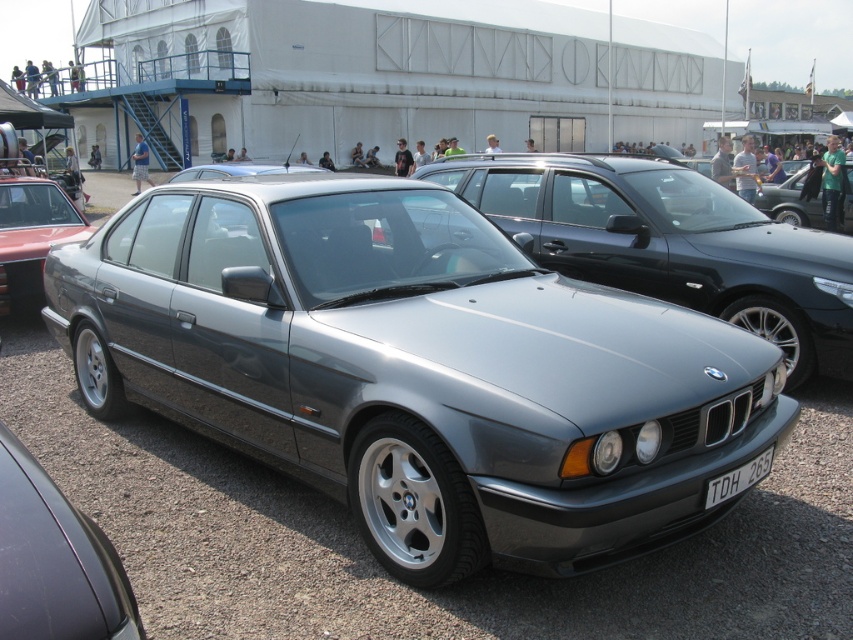
Is satin metallic car at center closer to camera compared to satin metallic sedan at center?

Yes, it is.

Between satin metallic car at center and satin metallic sedan at center, which one is positioned higher?

satin metallic sedan at center

Is point (373, 417) positioned behind point (666, 193)?

No, (373, 417) is in front of (666, 193).

The image size is (853, 640). Identify the location of satin metallic car at center. (416, 369).

Does satin black car at center have a greater height compared to white plastic license plate at lower center?

Yes.

Based on the photo, between satin black car at center and white plastic license plate at lower center, which one is positioned lower?

white plastic license plate at lower center is below.

Is point (67, 545) closer to viewer compared to point (740, 490)?

That is True.

Find the location of a particular element. This screenshot has height=640, width=853. satin black car at center is located at coordinates (54, 561).

From the picture: Is satin metallic car at center smaller than satin black car at center?

Incorrect, satin metallic car at center is not smaller in size than satin black car at center.

Looking at this image, can you confirm if satin metallic car at center is positioned above satin black car at center?

Yes, satin metallic car at center is above satin black car at center.

Is point (419, 576) more distant than point (3, 525)?

That is True.

Identify the location of satin metallic car at center. (416, 369).